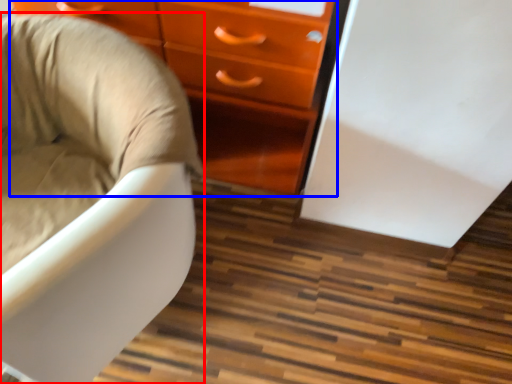
Question: Among these objects, which one is nearest to the camera, chair (highlighted by a red box) or chest of drawers (highlighted by a blue box)?

Choices:
 (A) chair
 (B) chest of drawers

Answer: (A)